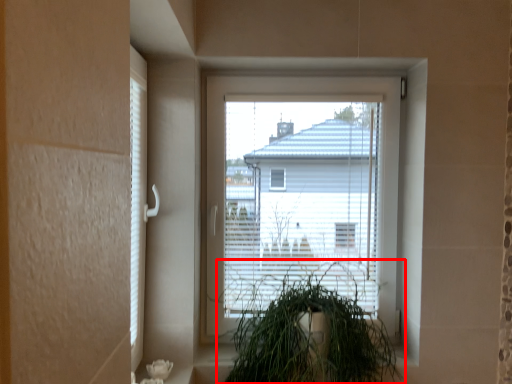
Question: Observing the image, what is the correct spatial positioning of houseplant (annotated by the red box) in reference to window?

Choices:
 (A) left
 (B) right

Answer: (A)